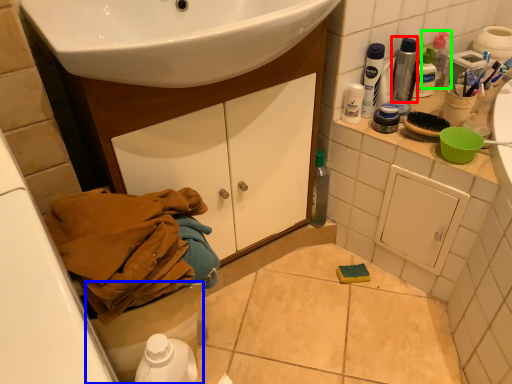
Question: Which is farther away from bottle (highlighted by a red box)? toilet bowl (highlighted by a blue box) or cleaning product (highlighted by a green box)?

Choices:
 (A) toilet bowl
 (B) cleaning product

Answer: (A)